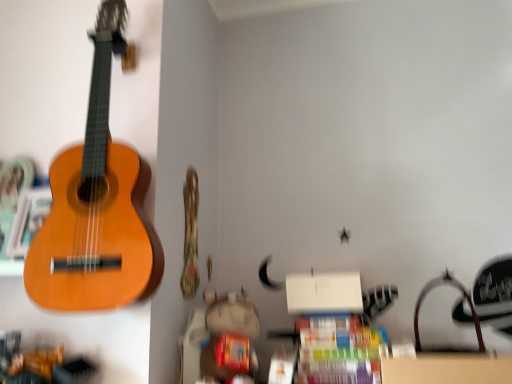
Based on the photo, measure the distance between point (110, 21) and camera.

They are 1.31 meters apart.

Image resolution: width=512 pixels, height=384 pixels. What do you see at coordinates (97, 204) in the screenshot?
I see `wooden acoustic guitar at left` at bounding box center [97, 204].

Where is `wooden acoustic guitar at left`? wooden acoustic guitar at left is located at coordinates (97, 204).

Find the location of a particular element. wooden acoustic guitar at left is located at coordinates (97, 204).